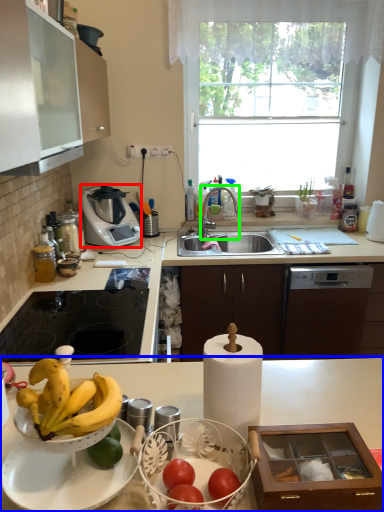
Question: Which is farther away from kitchen appliance (highlighted by a red box)? countertop (highlighted by a blue box) or tap (highlighted by a green box)?

Choices:
 (A) countertop
 (B) tap

Answer: (A)